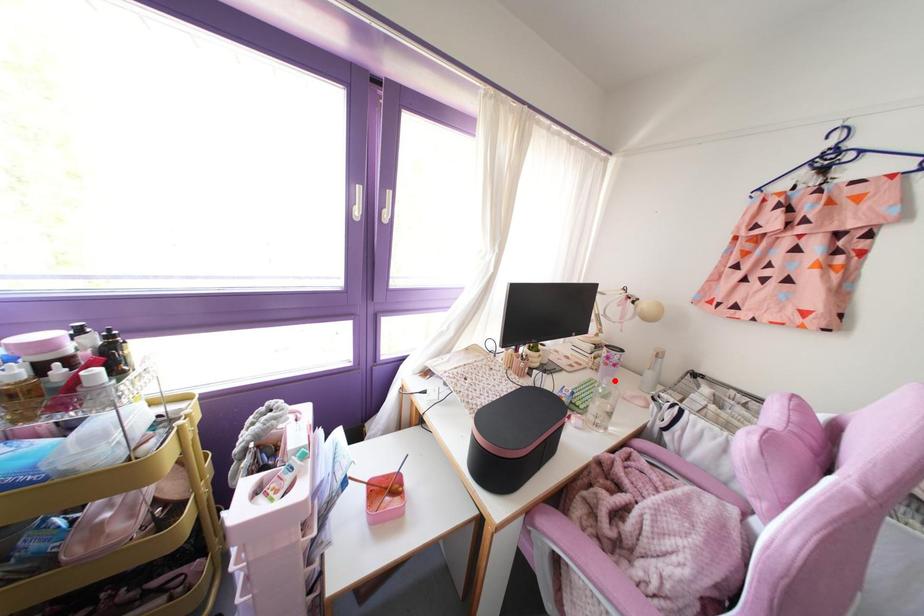
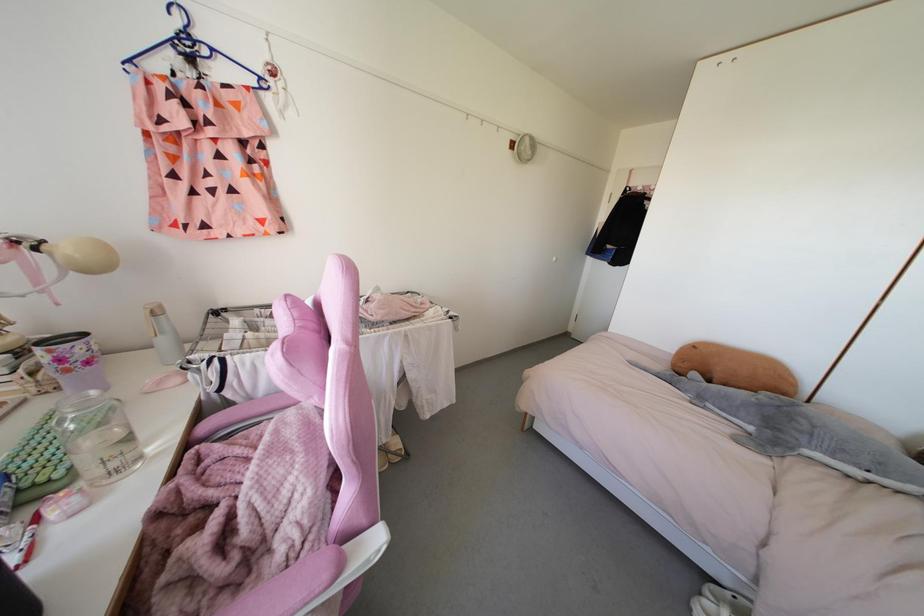
The point at the highlighted location is marked in the first image. Where is the corresponding point in the second image?

(92, 392)